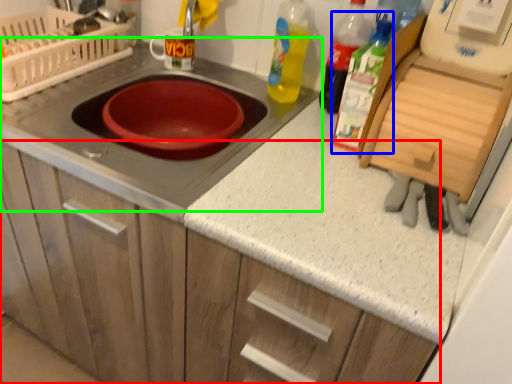
Question: Which is farther away from cabinetry (highlighted by a red box)? bottle (highlighted by a blue box) or gas stove (highlighted by a green box)?

Choices:
 (A) bottle
 (B) gas stove

Answer: (A)